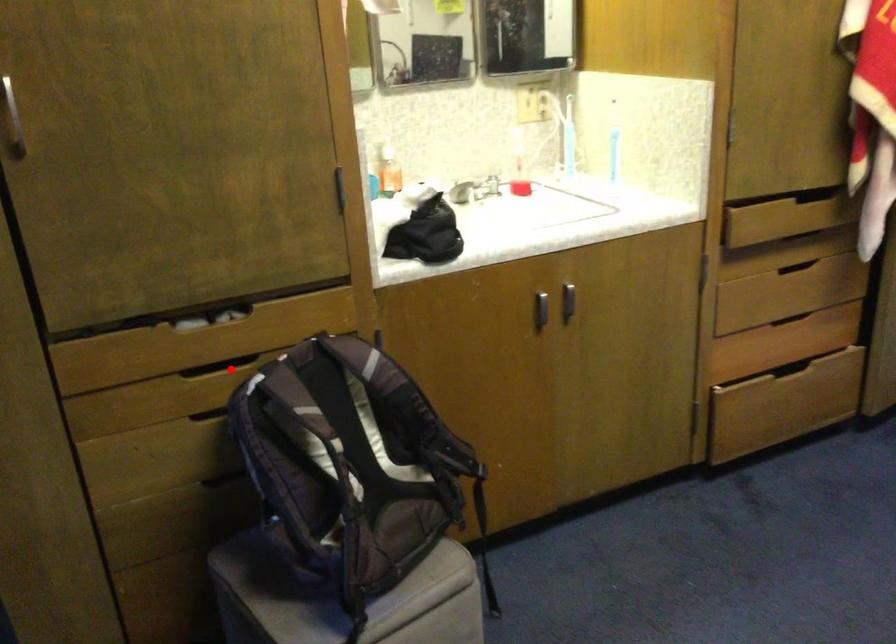
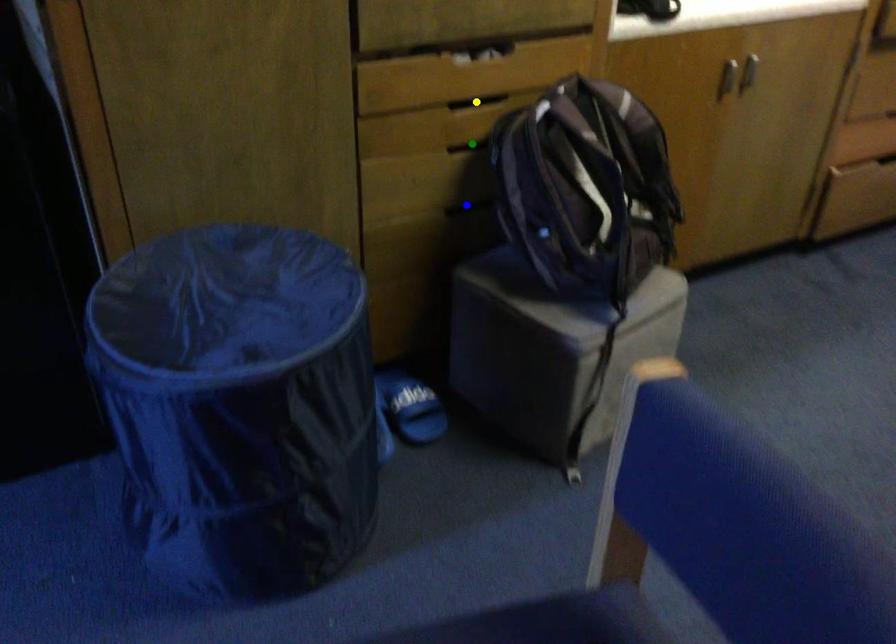
Question: I am providing you with two images of the same scene from different viewpoints. A red point is marked on the first image. You are given multiple points on the second image. Which point in image 2 is actually the same real-world point as the red point in image 1?

Choices:
 (A) yellow point
 (B) blue point
 (C) green point

Answer: (A)